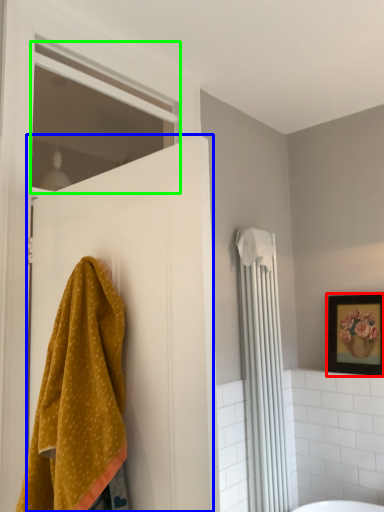
Question: Which object is the closest to the picture frame (highlighted by a red box)? Choose among these: door (highlighted by a blue box) or window (highlighted by a green box).

Choices:
 (A) door
 (B) window

Answer: (A)